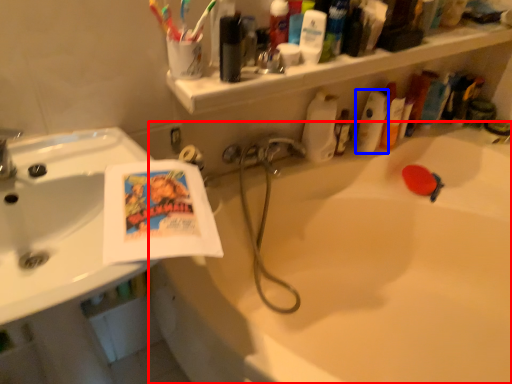
Question: Among these objects, which one is nearest to the camera, bathtub (highlighted by a red box) or cleaning product (highlighted by a blue box)?

Choices:
 (A) bathtub
 (B) cleaning product

Answer: (A)